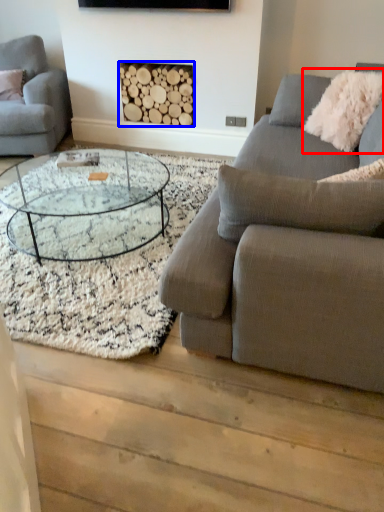
Question: Which object appears closest to the camera in this image, pillow (highlighted by a red box) or fireplace (highlighted by a blue box)?

Choices:
 (A) pillow
 (B) fireplace

Answer: (A)